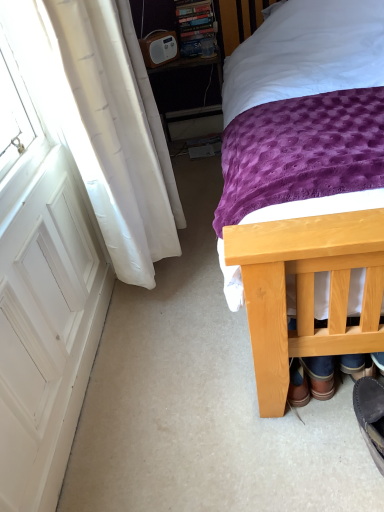
In order to face dark grey suede shoe at lower right, which is the first footwear from front to back, should I rotate leftwards or rightwards?

Turn right by 24.150 degrees to look at dark grey suede shoe at lower right, which is the first footwear from front to back.

What do you see at coordinates (371, 416) in the screenshot? I see `dark grey suede shoe at lower right, the 2th footwear positioned from the left` at bounding box center [371, 416].

This screenshot has height=512, width=384. What do you see at coordinates (45, 327) in the screenshot?
I see `white matte screen door at left` at bounding box center [45, 327].

Image resolution: width=384 pixels, height=512 pixels. What are the coordinates of `white plastic radio at upper center` in the screenshot? It's located at (188, 87).

You are a GUI agent. You are given a task and a screenshot of the screen. Output one action in this format:
    pyautogui.click(x=<x>, y=<y>)
    Task: Click on the brown leather boots at lower right, marked as the first footwear in a left-to-right arrangement
    This screenshot has width=384, height=512.
    Given the screenshot: What is the action you would take?
    point(320,376)

Where is `dark grey suede shoe at lower right, placed as the 1th footwear when sorted from right to left`? The height and width of the screenshot is (512, 384). dark grey suede shoe at lower right, placed as the 1th footwear when sorted from right to left is located at coordinates (371, 416).

Identify the location of nightstand below the wooden bed at center (from a real-world perspective). The width and height of the screenshot is (384, 512). (188, 87).

Can we say white plastic radio at upper center lies outside wooden bed at center?

Absolutely, white plastic radio at upper center is external to wooden bed at center.

Measure the distance between white plastic radio at upper center and wooden bed at center.

white plastic radio at upper center and wooden bed at center are 26.21 inches apart from each other.

Is point (206, 101) positioned after point (322, 295)?

Yes, point (206, 101) is behind point (322, 295).

From a real-world perspective, is dark grey suede shoe at lower right, the 2th footwear positioned from the left, over brown leather boots at lower right, marked as the first footwear in a left-to-right arrangement?

No.

Considering the sizes of dark grey suede shoe at lower right, the 2th footwear positioned from the left, and brown leather boots at lower right, acting as the 1th footwear starting from the back, in the image, is dark grey suede shoe at lower right, the 2th footwear positioned from the left, bigger or smaller than brown leather boots at lower right, acting as the 1th footwear starting from the back,?

Clearly, dark grey suede shoe at lower right, the 2th footwear positioned from the left, is larger in size than brown leather boots at lower right, acting as the 1th footwear starting from the back.

How different are the orientations of dark grey suede shoe at lower right, placed as the 1th footwear when sorted from right to left, and brown leather boots at lower right, acting as the 1th footwear starting from the back, in degrees?

dark grey suede shoe at lower right, placed as the 1th footwear when sorted from right to left, and brown leather boots at lower right, acting as the 1th footwear starting from the back, are facing 3.84 degrees away from each other.

Is dark grey suede shoe at lower right, the 2th footwear viewed from the back, to the left or to the right of brown leather boots at lower right, which ranks as the second footwear in front-to-back order, in the image?

In the image, dark grey suede shoe at lower right, the 2th footwear viewed from the back, appears on the right side of brown leather boots at lower right, which ranks as the second footwear in front-to-back order.

Consider the image. Which of these two, brown leather boots at lower right, marked as the first footwear in a left-to-right arrangement, or white matte screen door at left, stands shorter?

With less height is white matte screen door at left.

Which is more to the right, brown leather boots at lower right, marked as the first footwear in a left-to-right arrangement, or white matte screen door at left?

brown leather boots at lower right, marked as the first footwear in a left-to-right arrangement.

Can you confirm if brown leather boots at lower right, arranged as the 2th footwear when viewed from the right, is wider than white matte screen door at left?

Indeed, brown leather boots at lower right, arranged as the 2th footwear when viewed from the right, has a greater width compared to white matte screen door at left.

Image resolution: width=384 pixels, height=512 pixels. In the image, there is a brown leather boots at lower right, arranged as the 2th footwear when viewed from the right. In order to click on screen door above it (from the image's perspective) in this screenshot , I will do `click(45, 327)`.

From the image's perspective, between brown leather boots at lower right, arranged as the 2th footwear when viewed from the right, and wooden bed at center, who is located below?

From the image's view, brown leather boots at lower right, arranged as the 2th footwear when viewed from the right, is below.

Locate an element on the screen. bed above the brown leather boots at lower right, arranged as the 2th footwear when viewed from the right (from a real-world perspective) is located at coordinates (306, 282).

Is brown leather boots at lower right, acting as the 1th footwear starting from the back, in front of wooden bed at center?

No, it is behind wooden bed at center.

Which is behind, point (319, 396) or point (330, 280)?

The point (319, 396) is more distant.

Is wooden bed at center not near brown leather boots at lower right, marked as the first footwear in a left-to-right arrangement?

Yes.

Which point is more forward, (294, 207) or (313, 379)?

The point (294, 207) is in front.

Do you think wooden bed at center is within brown leather boots at lower right, arranged as the 2th footwear when viewed from the right, or outside of it?

The correct answer is: outside.

Is wooden bed at center oriented away from brown leather boots at lower right, acting as the 1th footwear starting from the back?

No, wooden bed at center's orientation is not away from brown leather boots at lower right, acting as the 1th footwear starting from the back.

Would you say dark grey suede shoe at lower right, the 2th footwear viewed from the back, is to the left or to the right of wooden bed at center in the picture?

From the image, it's evident that dark grey suede shoe at lower right, the 2th footwear viewed from the back, is to the left of wooden bed at center.

Is dark grey suede shoe at lower right, the 2th footwear viewed from the back, not close to wooden bed at center?

Yes, dark grey suede shoe at lower right, the 2th footwear viewed from the back, and wooden bed at center are quite far apart.

What's the angular difference between dark grey suede shoe at lower right, which is the first footwear from front to back, and wooden bed at center's facing directions?

The angle between the facing direction of dark grey suede shoe at lower right, which is the first footwear from front to back, and the facing direction of wooden bed at center is 179 degrees.

Locate an element on the screen. Image resolution: width=384 pixels, height=512 pixels. bed that appears on the right of dark grey suede shoe at lower right, placed as the 1th footwear when sorted from right to left is located at coordinates (306, 282).

How different are the orientations of white plastic radio at upper center and brown leather boots at lower right, arranged as the 2th footwear when viewed from the right, in degrees?

The angular difference between white plastic radio at upper center and brown leather boots at lower right, arranged as the 2th footwear when viewed from the right, is 177 degrees.

Is white plastic radio at upper center next to brown leather boots at lower right, marked as the first footwear in a left-to-right arrangement?

white plastic radio at upper center and brown leather boots at lower right, marked as the first footwear in a left-to-right arrangement, are not in contact.

Could brown leather boots at lower right, acting as the 1th footwear starting from the back, be considered to be inside white plastic radio at upper center?

No.

Is point (215, 70) in front of point (326, 376)?

No, it is not.

The height and width of the screenshot is (512, 384). Identify the location of bed below the white plastic radio at upper center (from the image's perspective). (306, 282).

This screenshot has height=512, width=384. I want to click on footwear located on the left of dark grey suede shoe at lower right, which is the first footwear from front to back, so (320, 376).

From the image, which object appears to be nearer to white plastic radio at upper center, wooden bed at center or brown leather boots at lower right, acting as the 1th footwear starting from the back?

The object closer to white plastic radio at upper center is wooden bed at center.

When comparing their distances from brown leather boots at lower right, which ranks as the second footwear in front-to-back order, does white matte screen door at left or dark grey suede shoe at lower right, the 2th footwear positioned from the left, seem further?

white matte screen door at left lies further to brown leather boots at lower right, which ranks as the second footwear in front-to-back order, than the other object.

Which object lies further to the anchor point white plastic radio at upper center, wooden bed at center or dark grey suede shoe at lower right, the 2th footwear positioned from the left?

Based on the image, dark grey suede shoe at lower right, the 2th footwear positioned from the left, appears to be further to white plastic radio at upper center.

Based on their spatial positions, is dark grey suede shoe at lower right, the 2th footwear positioned from the left, or white matte screen door at left further from white plastic radio at upper center?

dark grey suede shoe at lower right, the 2th footwear positioned from the left, is further to white plastic radio at upper center.

Based on their spatial positions, is brown leather boots at lower right, marked as the first footwear in a left-to-right arrangement, or white plastic radio at upper center closer to dark grey suede shoe at lower right, placed as the 1th footwear when sorted from right to left?

brown leather boots at lower right, marked as the first footwear in a left-to-right arrangement, is closer to dark grey suede shoe at lower right, placed as the 1th footwear when sorted from right to left.

Which object lies nearer to the anchor point white matte screen door at left, white plastic radio at upper center or brown leather boots at lower right, which ranks as the second footwear in front-to-back order?

Based on the image, brown leather boots at lower right, which ranks as the second footwear in front-to-back order, appears to be nearer to white matte screen door at left.

Considering their positions, is brown leather boots at lower right, which ranks as the second footwear in front-to-back order, positioned further to white matte screen door at left than white plastic radio at upper center?

white plastic radio at upper center is further to white matte screen door at left.

Which object lies nearer to the anchor point wooden bed at center, brown leather boots at lower right, marked as the first footwear in a left-to-right arrangement, or dark grey suede shoe at lower right, the 2th footwear positioned from the left?

brown leather boots at lower right, marked as the first footwear in a left-to-right arrangement, is closer to wooden bed at center.

Image resolution: width=384 pixels, height=512 pixels. Identify the location of screen door between wooden bed at center and white plastic radio at upper center in the front-back direction. (45, 327).

In order to click on screen door between white plastic radio at upper center and dark grey suede shoe at lower right, placed as the 1th footwear when sorted from right to left, in the vertical direction in this screenshot , I will do `click(45, 327)`.

What are the coordinates of `screen door between wooden bed at center and dark grey suede shoe at lower right, the 2th footwear positioned from the left, vertically` in the screenshot? It's located at (45, 327).

Identify the location of footwear between wooden bed at center and dark grey suede shoe at lower right, the 2th footwear viewed from the back, vertically. Image resolution: width=384 pixels, height=512 pixels. (320, 376).